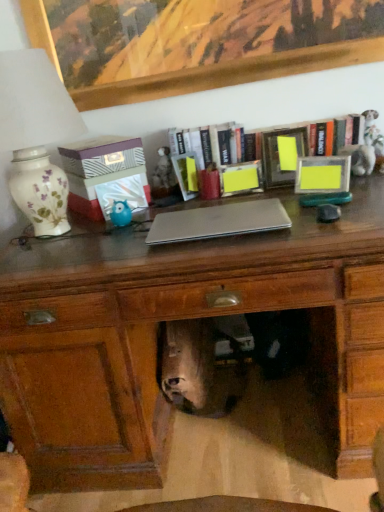
The height and width of the screenshot is (512, 384). What are the coordinates of `vacant space to the left of silver metallic laptop at center` in the screenshot? It's located at (108, 246).